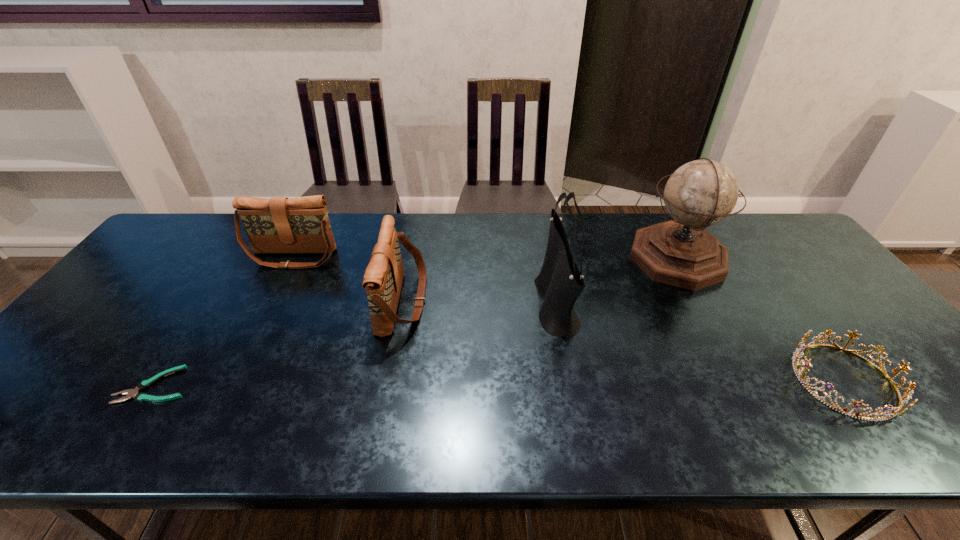
You are a GUI agent. You are given a task and a screenshot of the screen. Output one action in this format:
    pyautogui.click(x=<x>, y=<y>)
    Task: Click on the free space located 0.210m on the surface of the globe
    The image size is (960, 540).
    Given the screenshot: What is the action you would take?
    pyautogui.click(x=561, y=259)

Locate an element on the screen. This screenshot has width=960, height=540. vacant space situated on the front-facing side of the second shoulder bag from left to right is located at coordinates (458, 301).

At what (x,y) coordinates should I click in order to perform the action: click on vacant space positioned 0.190m on the front-facing side of the leftmost shoulder bag. Please return your answer as a coordinate pair (x, y). The height and width of the screenshot is (540, 960). Looking at the image, I should click on (264, 316).

At what (x,y) coordinates should I click in order to perform the action: click on vacant space located 0.090m on the front-facing side of the tiara. Please return your answer as a coordinate pair (x, y). Image resolution: width=960 pixels, height=540 pixels. Looking at the image, I should click on (755, 380).

At what (x,y) coordinates should I click in order to perform the action: click on vacant space located 0.380m on the front-facing side of the tiara. Please return your answer as a coordinate pair (x, y). Looking at the image, I should click on (629, 380).

Locate an element on the screen. free location located on the front-facing side of the tiara is located at coordinates (655, 380).

Identify the location of vacant space located on the left of the shortest object. pyautogui.click(x=60, y=385).

Locate an element on the screen. This screenshot has height=540, width=960. globe present at the far edge is located at coordinates (701, 193).

Locate an element on the screen. shoulder bag that is positioned at the far edge is located at coordinates (279, 225).

I want to click on object located in the near edge section of the desktop, so click(907, 395).